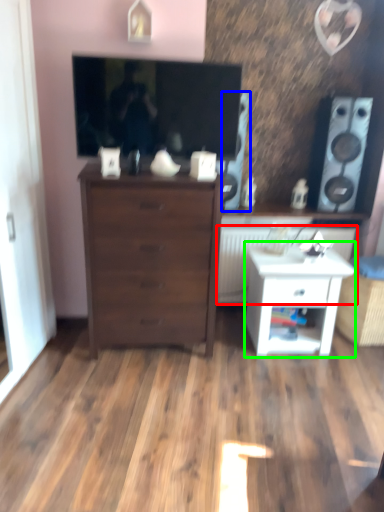
Question: Estimate the real-world distances between objects in this image. Which object is closer to radiator (highlighted by a red box), speaker (highlighted by a blue box) or nightstand (highlighted by a green box)?

Choices:
 (A) speaker
 (B) nightstand

Answer: (B)